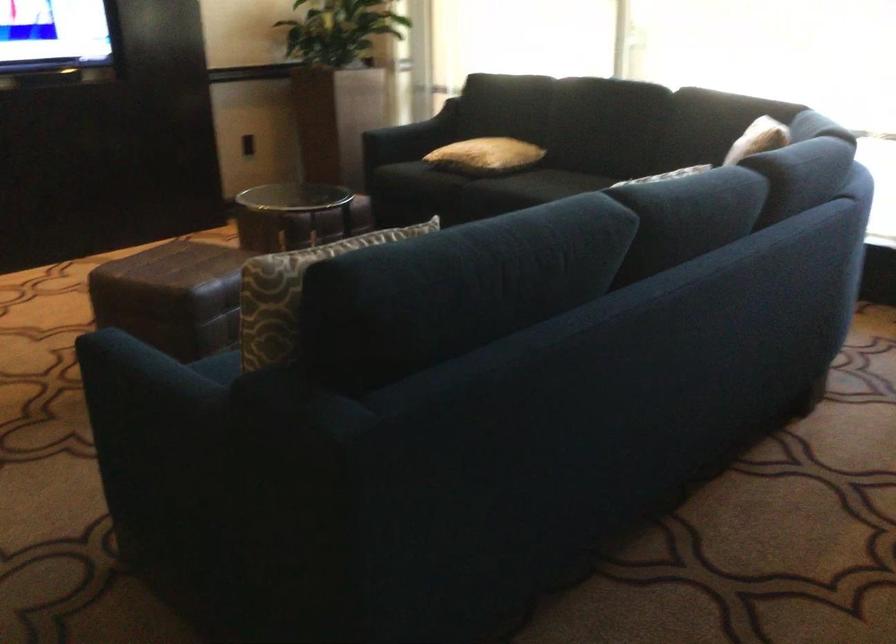
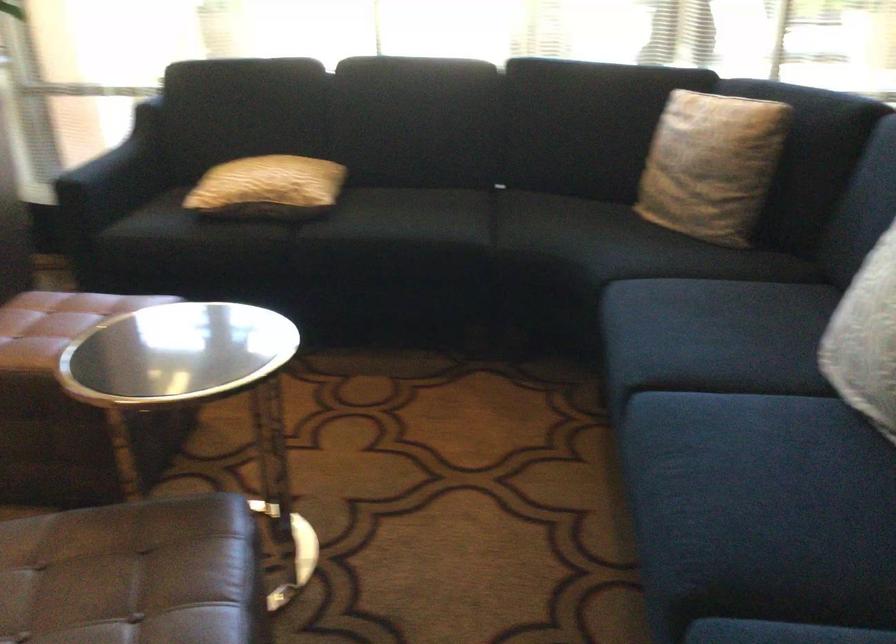
The point at (197, 267) is marked in the first image. Where is the corresponding point in the second image?

(134, 574)